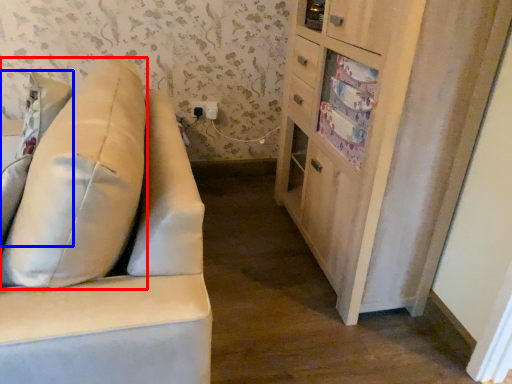
Question: Which object appears closest to the camera in this image, throw pillow (highlighted by a red box) or pillow (highlighted by a blue box)?

Choices:
 (A) throw pillow
 (B) pillow

Answer: (A)